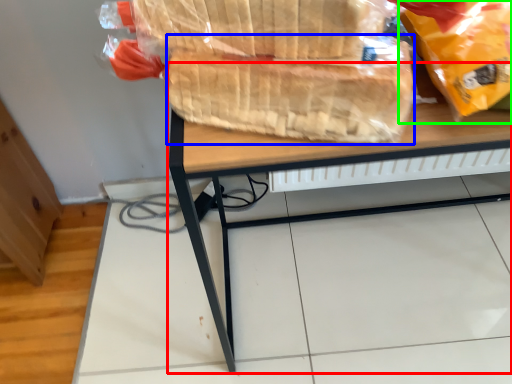
Question: Which is farther away from desk (highlighted by a red box)? bread (highlighted by a blue box) or plastic bag (highlighted by a green box)?

Choices:
 (A) bread
 (B) plastic bag

Answer: (B)